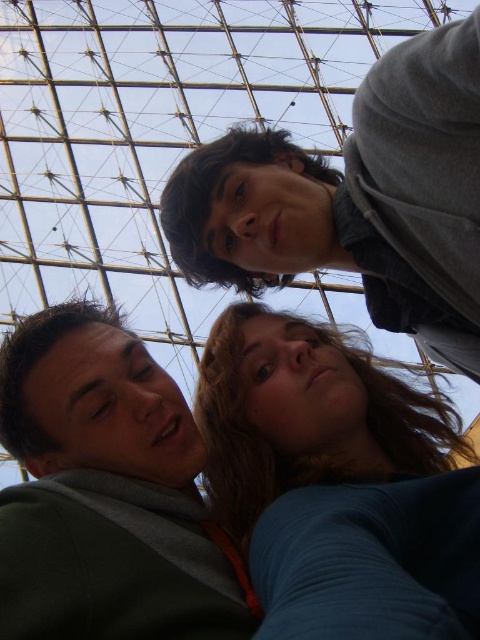
You are a photographer trying to capture the blue fabric at center and the green matte jacket at lower left in a single shot. Given their sizes, which object would you need to position closer to the camera to ensure both appear similarly sized in the final photo?

The green matte jacket at lower left is smaller in size compared to the blue fabric at center. To make them appear similarly sized in the photo, you should position the green matte jacket at lower left closer to the camera than the blue fabric at center.